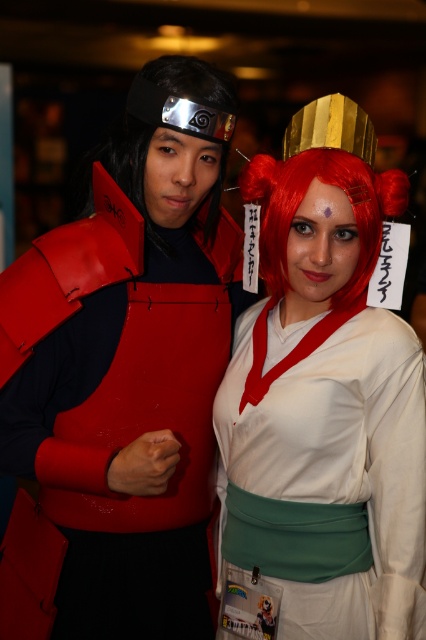
You are organizing a cosplay display and need to place the white matte kimono at center and the yellow paper comic book at lower center on a shelf. Which object should you place first to ensure they both fit without overlapping?

The white matte kimono at center is wider than the yellow paper comic book at lower center, so you should place the white matte kimono at center first to accommodate its greater width before placing the yellow paper comic book at lower center.

You are a photographer setting up a shoot with two cosplayers. You have a backdrop that is 1.5 meters wide. The cosplayer wearing the rubberized red vest at left and the one with the shiny red wig at center are standing side by side. Based on their widths, will they both fit within the backdrop if positioned closely together?

The rubberized red vest at left is wider than the shiny red wig at center. Since the total width of both cosplayers together may exceed the 1.5 meter backdrop, it depends on their combined widths. However, the description only states the vest is wider, not the exact measurements. Without specific widths, we cannot confirm if they will fit.

You are a photographer setting up for a cosplay photoshoot. The scene includes a white matte kimono at center and a yellow paper comic book at lower center. You need to ensure both items are visible in the frame. Given their sizes, which item should you focus on positioning first to avoid cropping?

The white matte kimono at center is bigger than the yellow paper comic book at lower center, so you should focus on positioning the white matte kimono at center first to ensure it fits properly, allowing the smaller comic book to be framed naturally.